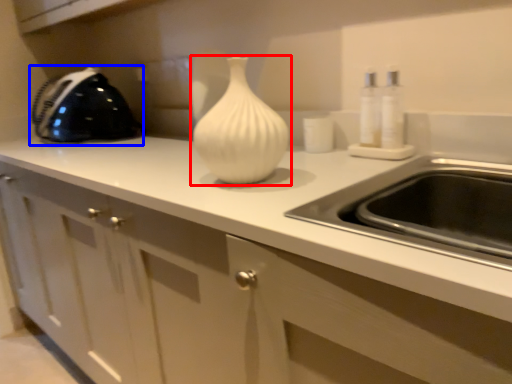
Question: Which object appears farthest to the camera in this image, vase (highlighted by a red box) or appliance (highlighted by a blue box)?

Choices:
 (A) vase
 (B) appliance

Answer: (B)